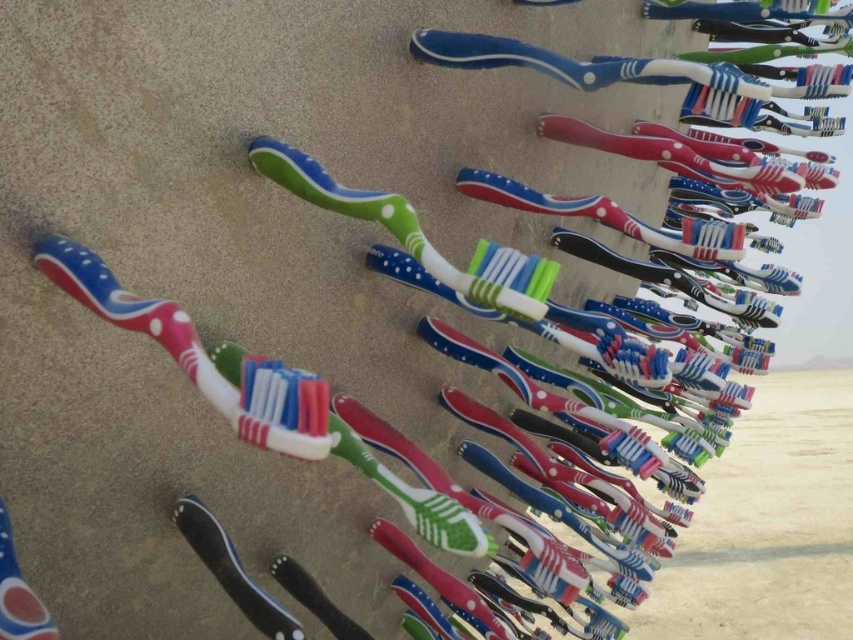
You are a dentist organizing a display. You have a small shelf that can only hold items that take up less space than the blue glossy toothbrush at upper right. Can the matte plastic toothbrush at center fit on the shelf?

The matte plastic toothbrush at center occupies less space than the blue glossy toothbrush at upper right, so it can fit on the shelf.

You are a dentist examining the arrangement of toothbrushes. You need to place a new toothbrush between the matte plastic toothbrush at center and the blue glossy toothbrush at upper right. Where should you position it?

The new toothbrush should be placed between the matte plastic toothbrush at center and the blue glossy toothbrush at upper right, to the right of the matte plastic toothbrush at center and to the left of the blue glossy toothbrush at upper right since the matte plastic toothbrush at center is to the left of the blue glossy toothbrush at upper right.

You are a robot tasked with picking up the blue glossy toothbrush at upper right and the matte plastic toothpaste at lower left. The robot has a maximum reach of 25 inches. Can you determine if you can reach both items without moving your position?

The blue glossy toothbrush at upper right and the matte plastic toothpaste at lower left are 25.92 inches apart from each other. Since the robot has a maximum reach of 25 inches, it cannot reach both items without moving its position because the distance between them exceeds the robot arm length.